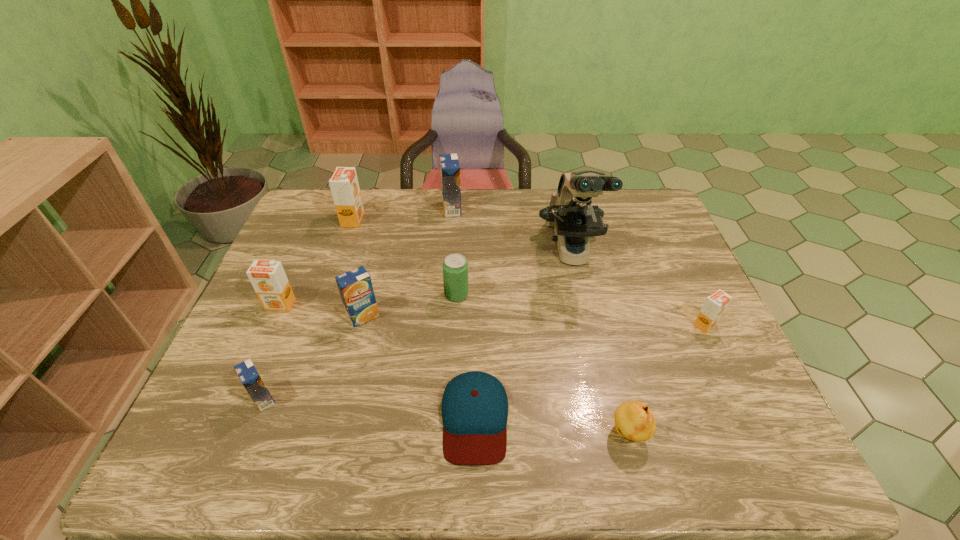
In the image, there is a desktop. Where is `vacant space at the far edge`? vacant space at the far edge is located at coordinates (415, 210).

In the image, there is a desktop. In order to click on vacant space at the near edge in this screenshot , I will do `click(450, 470)`.

I want to click on vacant region at the right edge of the desktop, so pyautogui.click(x=694, y=302).

The image size is (960, 540). I want to click on vacant region at the near left corner, so click(250, 453).

Find the location of a particular element. The image size is (960, 540). free spot between the rightmost orange orange juice and the shortest object is located at coordinates (x=590, y=372).

Where is `free space that is in between the tallest object and the nearest orange orange juice`? Image resolution: width=960 pixels, height=540 pixels. free space that is in between the tallest object and the nearest orange orange juice is located at coordinates (638, 288).

Identify the location of vacant point located between the fifth orange juice from left to right and the smallest orange orange juice. (579, 267).

The height and width of the screenshot is (540, 960). Find the location of `vacant area between the second farthest orange orange juice and the baseball cap`. vacant area between the second farthest orange orange juice and the baseball cap is located at coordinates (377, 361).

Where is `free space between the seventh object from right to left and the soda`? The height and width of the screenshot is (540, 960). free space between the seventh object from right to left and the soda is located at coordinates (410, 306).

Find the location of a particular element. blank region between the pear and the tallest object is located at coordinates (601, 342).